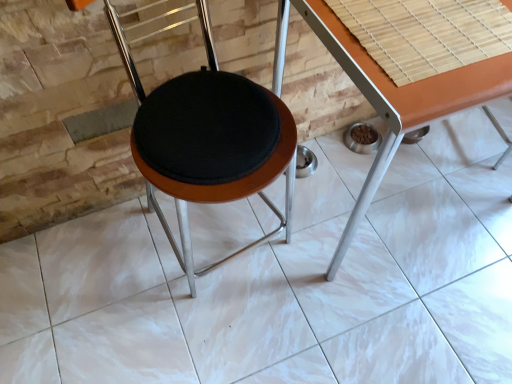
Locate an element on the screen. This screenshot has height=384, width=512. vacant area situated below black fabric cushion at center (from a real-world perspective) is located at coordinates (222, 244).